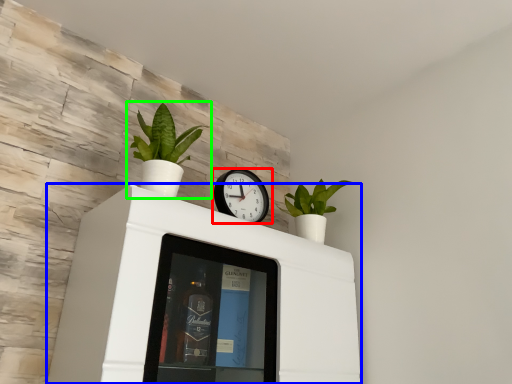
Question: Which is farther away from wall clock (highlighted by a red box)? furniture (highlighted by a blue box) or houseplant (highlighted by a green box)?

Choices:
 (A) furniture
 (B) houseplant

Answer: (A)